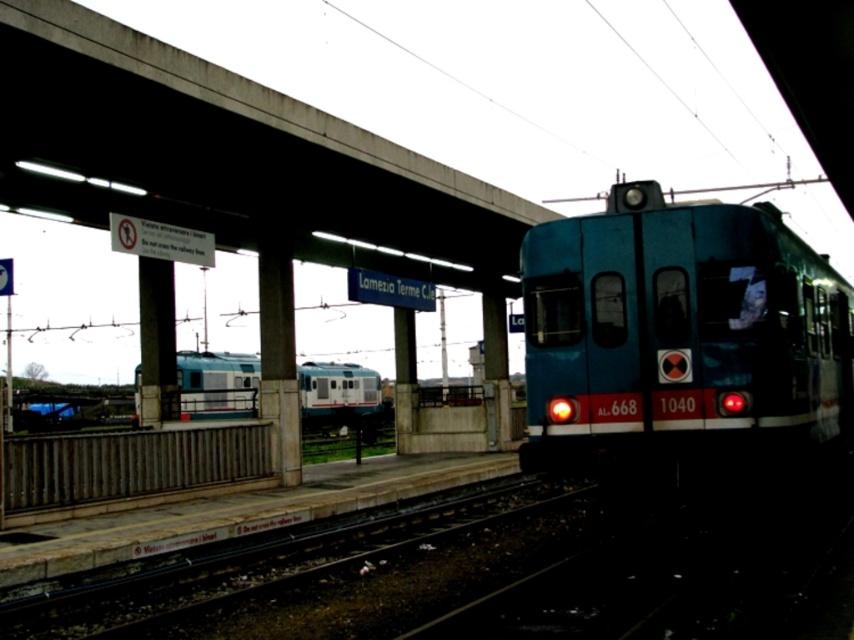
You are standing at the railway station and see the point marked as point (229,157). What is located at that point?

The point (229,157) corresponds to concrete at upper center.

You are standing at the railway station and see two points marked on the ground. The first point is at coordinate point(572,227) and the second is at point(230,355). Based on the scene, which point is closer to the blue and white train marked with AL 668 and 1040?

Point(572,227) is closer to the blue and white train marked with AL 668 and 1040 because it is in front of point(230,355).